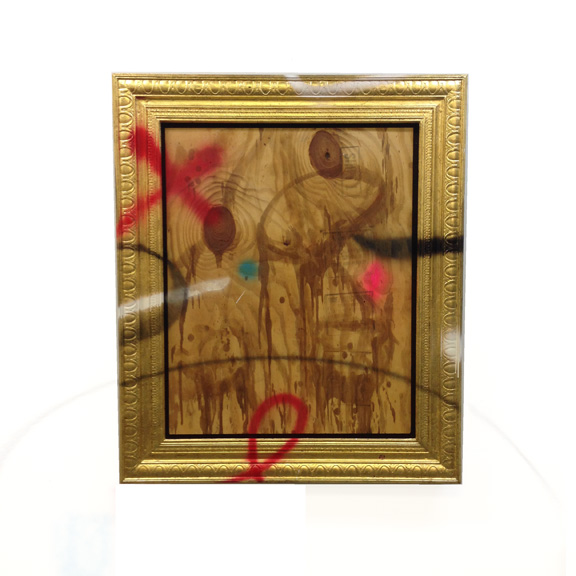
Identify the location of golden frame. The height and width of the screenshot is (576, 576). tap(435, 107).